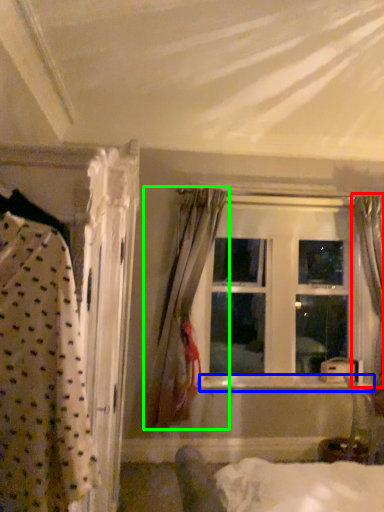
Question: Based on their relative distances, which object is farther from curtain (highlighted by a red box)? Choose from window sill (highlighted by a blue box) and curtain (highlighted by a green box).

Choices:
 (A) window sill
 (B) curtain

Answer: (B)